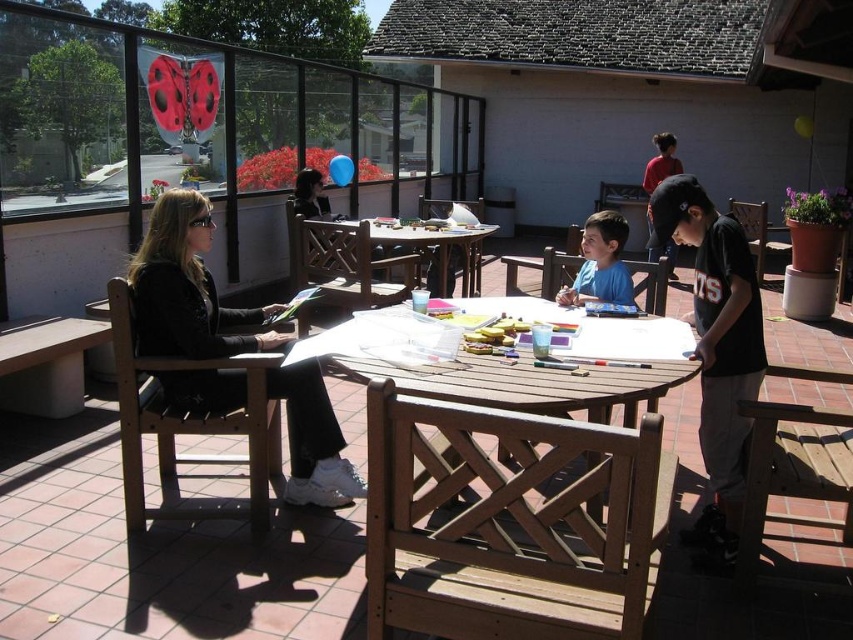
Is the position of black leather jacket at left more distant than that of black cotton shirt at center?

Yes, black leather jacket at left is further from the viewer.

Between black leather jacket at left and black cotton shirt at center, which one is positioned lower?

black leather jacket at left is lower down.

Does point (200, 390) lie in front of point (732, 225)?

No, it is behind (732, 225).

Find the location of a particular element. The width and height of the screenshot is (853, 640). black leather jacket at left is located at coordinates (187, 289).

Who is positioned more to the left, black cotton shirt at center or wooden table at center?

Answer: From the viewer's perspective, wooden table at center appears more on the left side.

Is point (759, 349) closer to viewer compared to point (473, 250)?

Yes, point (759, 349) is closer to viewer.

Which is behind, point (697, 296) or point (465, 275)?

Point (465, 275)

At what (x,y) coordinates should I click in order to perform the action: click on black cotton shirt at center. Please return your answer as a coordinate pair (x, y). The width and height of the screenshot is (853, 640). Looking at the image, I should click on click(x=717, y=348).

Between wooden picnic table at center and blue matte shirt at center, which one is positioned lower?

wooden picnic table at center

Identify the location of wooden picnic table at center. This screenshot has height=640, width=853. (514, 499).